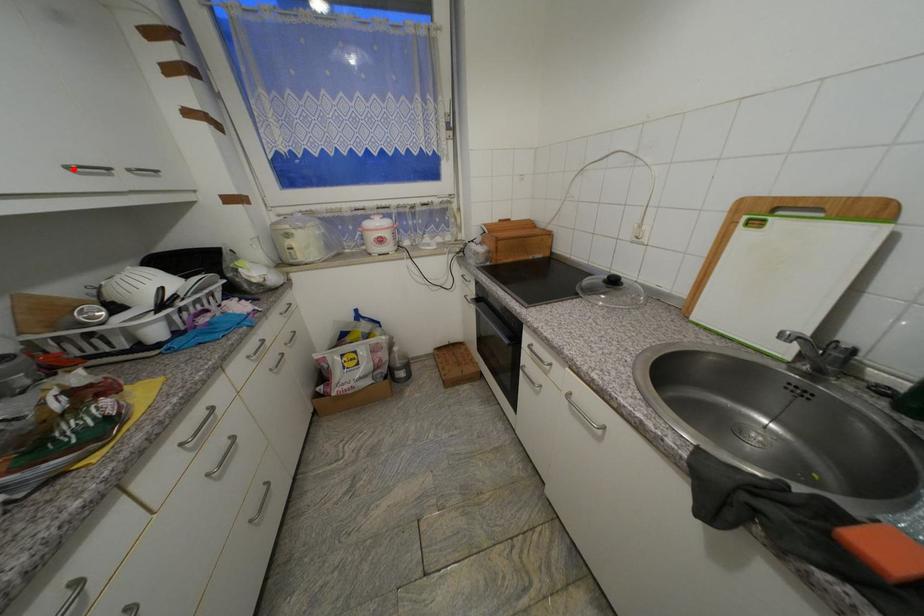
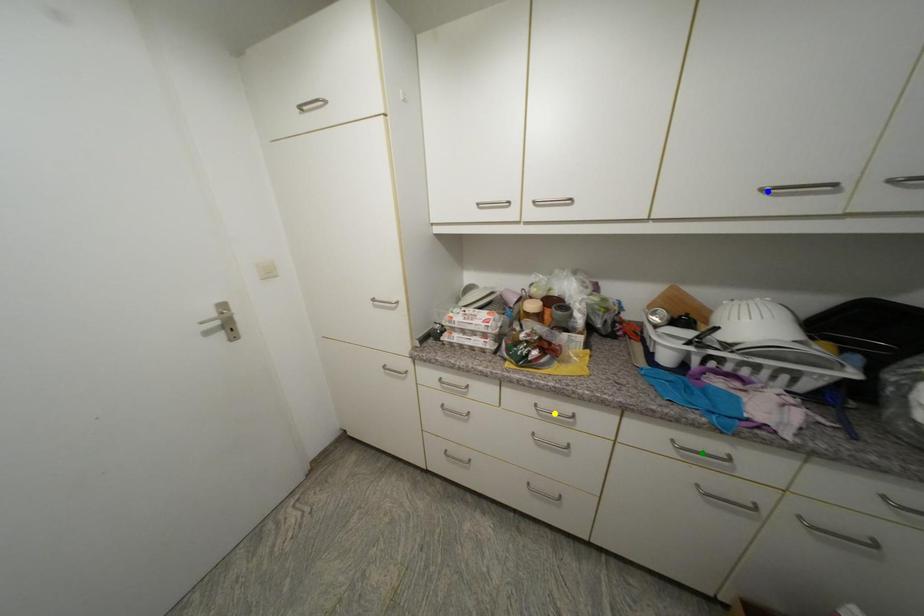
Question: I am providing you with two images of the same scene from different viewpoints. A red point is marked on the first image. You are given multiple points on the second image. Which point in image 2 represents the same 3d spot as the red point in image 1?

Choices:
 (A) blue point
 (B) green point
 (C) yellow point

Answer: (A)